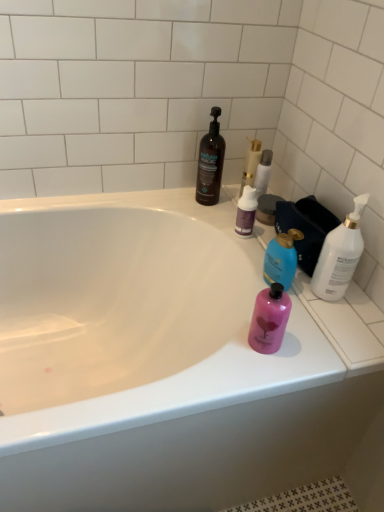
Question: Is white glossy bathtub at upper center located within gold metallic candle at upper center?

Choices:
 (A) no
 (B) yes

Answer: (A)

Question: From a real-world perspective, is gold metallic candle at upper center physically above white glossy bathtub at upper center?

Choices:
 (A) yes
 (B) no

Answer: (A)

Question: Is gold metallic candle at upper center thinner than white glossy bathtub at upper center?

Choices:
 (A) yes
 (B) no

Answer: (A)

Question: From the image's perspective, does gold metallic candle at upper center appear higher than white glossy bathtub at upper center?

Choices:
 (A) yes
 (B) no

Answer: (A)

Question: Can you confirm if gold metallic candle at upper center is positioned to the left of white glossy bathtub at upper center?

Choices:
 (A) no
 (B) yes

Answer: (A)

Question: Considering the relative sizes of gold metallic candle at upper center and white glossy bathtub at upper center in the image provided, is gold metallic candle at upper center bigger than white glossy bathtub at upper center?

Choices:
 (A) yes
 (B) no

Answer: (B)

Question: Is pink matte bottle at right, positioned as the third bottle in right-to-left order, positioned with its back to white glossy bottle at right, the 1th bottle in the right-to-left sequence?

Choices:
 (A) yes
 (B) no

Answer: (B)

Question: Is pink matte bottle at right, positioned as the third bottle in right-to-left order, wider than white glossy bottle at right, which appears as the 5th bottle when viewed from the left?

Choices:
 (A) no
 (B) yes

Answer: (A)

Question: Considering the relative sizes of pink matte bottle at right, marked as the third bottle in a left-to-right arrangement, and white glossy bottle at right, which appears as the 5th bottle when viewed from the left, in the image provided, is pink matte bottle at right, marked as the third bottle in a left-to-right arrangement, thinner than white glossy bottle at right, which appears as the 5th bottle when viewed from the left,?

Choices:
 (A) no
 (B) yes

Answer: (B)

Question: Considering the relative sizes of pink matte bottle at right, positioned as the third bottle in right-to-left order, and white glossy bottle at right, which appears as the 5th bottle when viewed from the left, in the image provided, is pink matte bottle at right, positioned as the third bottle in right-to-left order, taller than white glossy bottle at right, which appears as the 5th bottle when viewed from the left,?

Choices:
 (A) yes
 (B) no

Answer: (B)

Question: Is pink matte bottle at right, positioned as the third bottle in right-to-left order, to the right of white glossy bottle at right, the 1th bottle in the right-to-left sequence, from the viewer's perspective?

Choices:
 (A) no
 (B) yes

Answer: (A)

Question: Does pink matte bottle at right, marked as the third bottle in a left-to-right arrangement, come in front of white glossy bottle at right, which appears as the 5th bottle when viewed from the left?

Choices:
 (A) yes
 (B) no

Answer: (A)

Question: Is white glossy bathtub at upper center not close to pink matte bottle at right, positioned as the third bottle in right-to-left order?

Choices:
 (A) no
 (B) yes

Answer: (A)